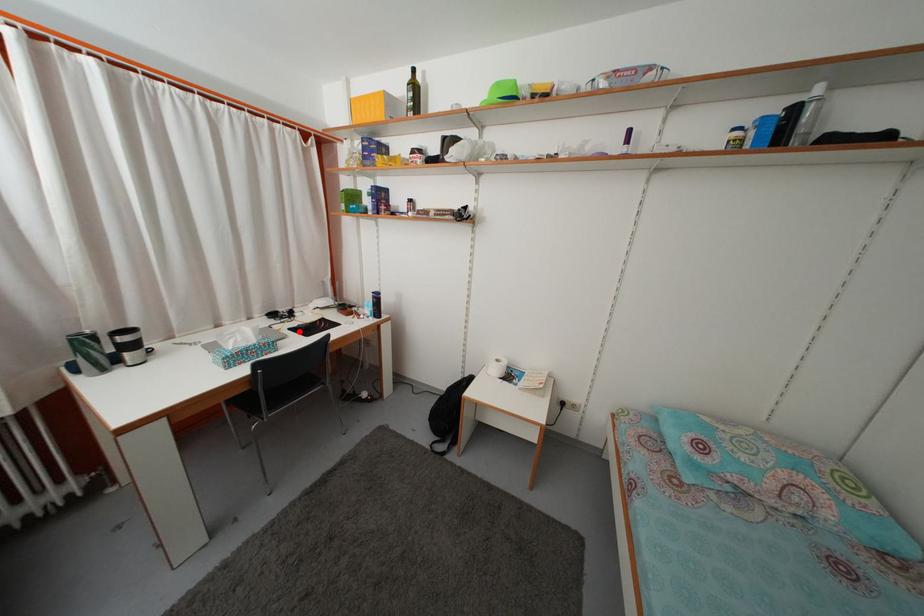
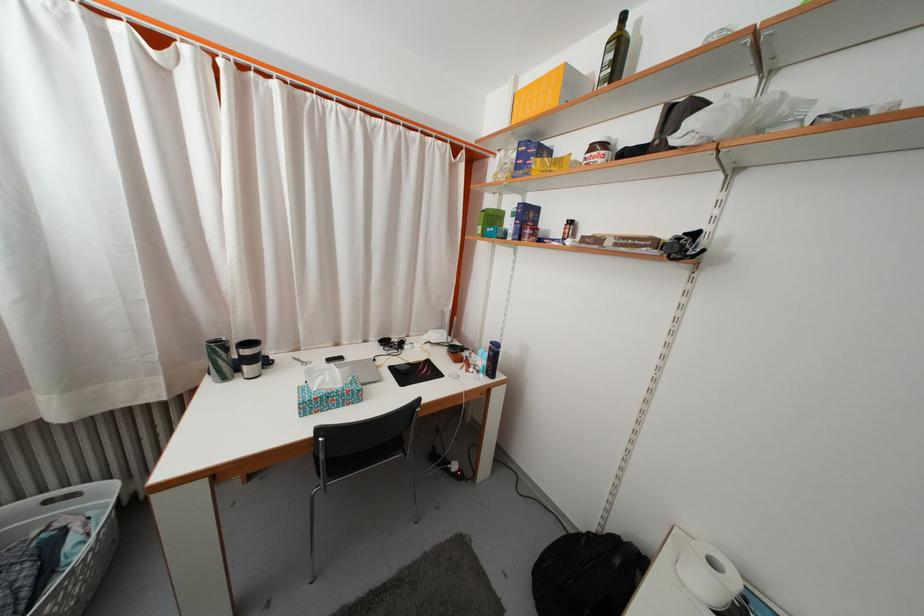
The point at the highlighted location is marked in the first image. Where is the corresponding point in the second image?

(402, 369)